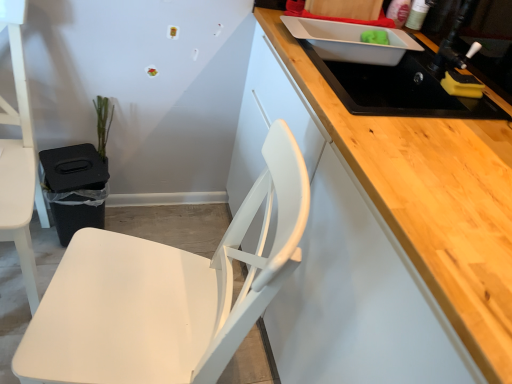
Question: Should I look upward or downward to see white matte chair at left, marked as the 1th chair in a left-to-right arrangement?

Choices:
 (A) up
 (B) down

Answer: (A)

Question: From a real-world perspective, is green matte plant at left below white matte chair at lower left, the 2th chair in the left-to-right sequence?

Choices:
 (A) no
 (B) yes

Answer: (B)

Question: Is green matte plant at left directly adjacent to white matte chair at lower left, which appears as the first chair when viewed from the right?

Choices:
 (A) no
 (B) yes

Answer: (A)

Question: Is green matte plant at left far from white matte chair at lower left, the 2th chair in the left-to-right sequence?

Choices:
 (A) yes
 (B) no

Answer: (B)

Question: Is green matte plant at left at the right side of white matte chair at lower left, which appears as the first chair when viewed from the right?

Choices:
 (A) yes
 (B) no

Answer: (B)

Question: Can white matte chair at lower left, which appears as the first chair when viewed from the right, be found inside green matte plant at left?

Choices:
 (A) yes
 (B) no

Answer: (B)

Question: Can you confirm if green matte plant at left is wider than white matte chair at lower left, which appears as the first chair when viewed from the right?

Choices:
 (A) no
 (B) yes

Answer: (A)

Question: Is black matte sink at upper right placed right next to white matte chair at left, marked as the 1th chair in a left-to-right arrangement?

Choices:
 (A) yes
 (B) no

Answer: (B)

Question: Is black matte sink at upper right taller than white matte chair at left, positioned as the second chair in right-to-left order?

Choices:
 (A) no
 (B) yes

Answer: (A)

Question: Is white matte chair at left, marked as the 1th chair in a left-to-right arrangement, inside black matte sink at upper right?

Choices:
 (A) yes
 (B) no

Answer: (B)

Question: Considering the relative positions of black matte sink at upper right and white matte chair at left, positioned as the second chair in right-to-left order, in the image provided, is black matte sink at upper right in front of white matte chair at left, positioned as the second chair in right-to-left order,?

Choices:
 (A) yes
 (B) no

Answer: (B)

Question: From the image's perspective, is black matte sink at upper right below white matte chair at left, marked as the 1th chair in a left-to-right arrangement?

Choices:
 (A) yes
 (B) no

Answer: (B)

Question: From the image's perspective, would you say black matte sink at upper right is positioned over white matte chair at left, positioned as the second chair in right-to-left order?

Choices:
 (A) yes
 (B) no

Answer: (A)

Question: Would you consider white matte chair at lower left, which appears as the first chair when viewed from the right, to be distant from white matte chair at left, positioned as the second chair in right-to-left order?

Choices:
 (A) no
 (B) yes

Answer: (A)